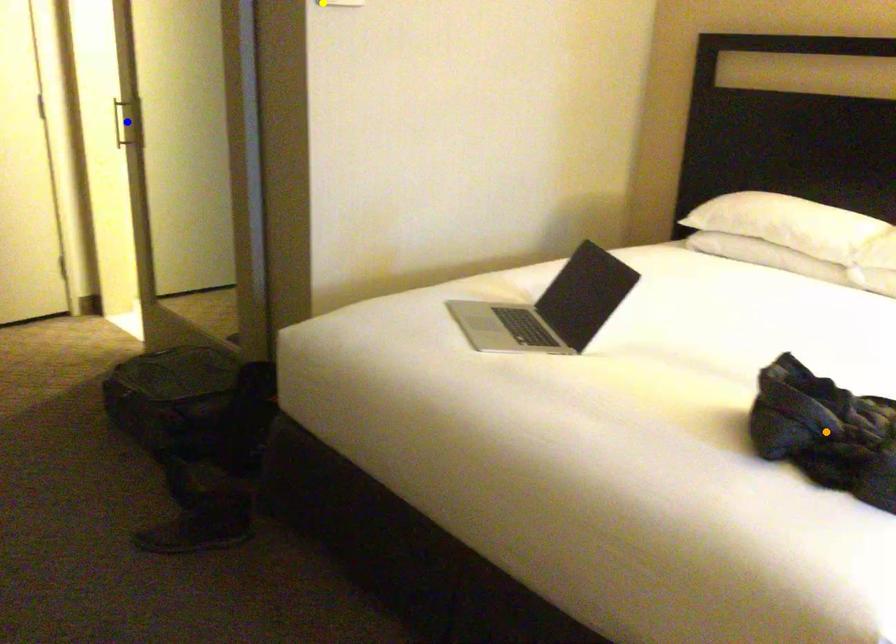
Order these from farthest to nearest:
orange point, blue point, yellow point

1. blue point
2. yellow point
3. orange point